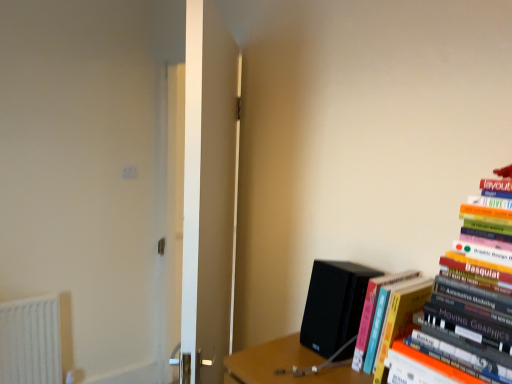
At what (x,y) coordinates should I click in order to perform the action: click on free location above orange matte book at right, which is the second book from front to back (from a real-world perspective). Please return your answer as a coordinate pair (x, y). This screenshot has width=512, height=384. Looking at the image, I should click on (404, 275).